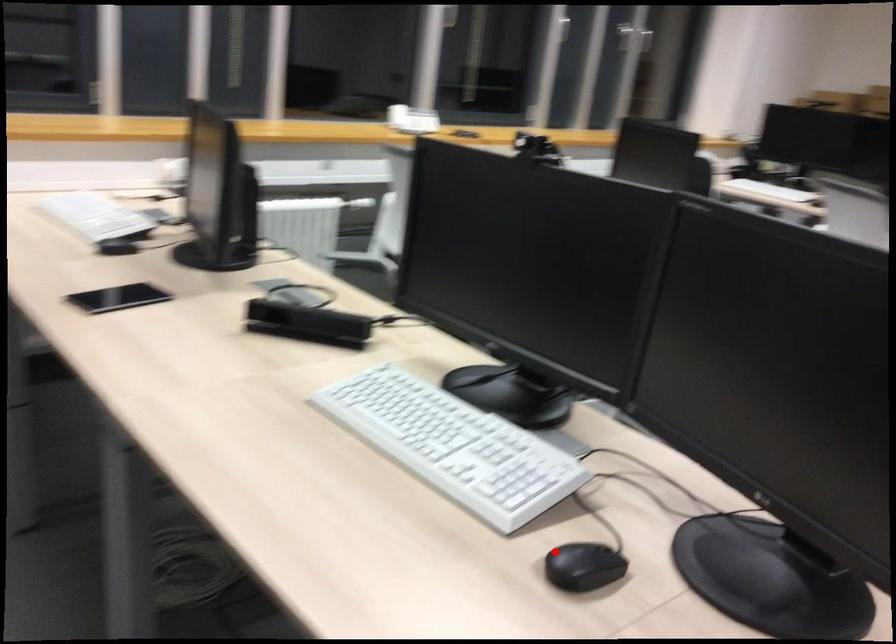
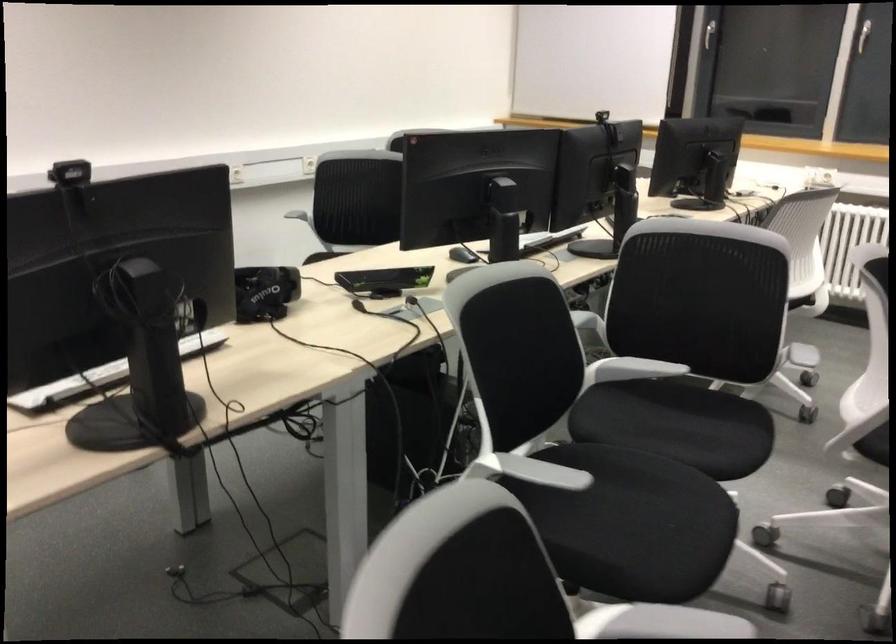
The point at the highlighted location is marked in the first image. Where is the corresponding point in the second image?

(462, 254)